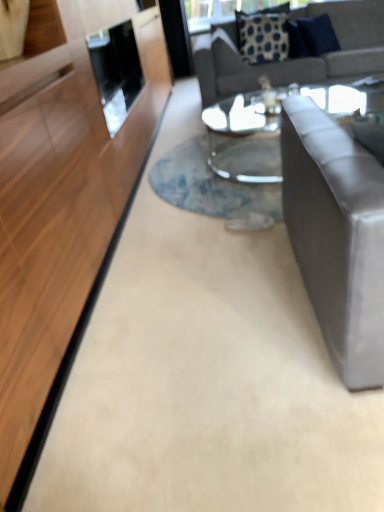
Question: Can blue dotted fabric pillow at upper center, the second pillow in the right-to-left sequence, be found inside satin gray couch at right, which ranks as the 2th studio couch in back-to-front order?

Choices:
 (A) no
 (B) yes

Answer: (A)

Question: Is satin gray couch at right, acting as the 1th studio couch starting from the front, at the right side of blue dotted fabric pillow at upper center, the second pillow in the right-to-left sequence?

Choices:
 (A) yes
 (B) no

Answer: (B)

Question: Is satin gray couch at right, acting as the 1th studio couch starting from the front, touching blue dotted fabric pillow at upper center, the second pillow in the right-to-left sequence?

Choices:
 (A) yes
 (B) no

Answer: (B)

Question: Is satin gray couch at right, placed as the second studio couch when sorted from top to bottom, not inside blue dotted fabric pillow at upper center, the 1th pillow in the left-to-right sequence?

Choices:
 (A) no
 (B) yes

Answer: (B)

Question: Is satin gray couch at right, acting as the 1th studio couch starting from the front, positioned far away from blue dotted fabric pillow at upper center, the 1th pillow in the left-to-right sequence?

Choices:
 (A) yes
 (B) no

Answer: (A)

Question: Looking at the image, does clear glass coffee table at center seem bigger or smaller compared to blue dotted fabric pillow at upper center, the second pillow in the right-to-left sequence?

Choices:
 (A) small
 (B) big

Answer: (B)

Question: Based on their positions, is clear glass coffee table at center located to the left or right of blue dotted fabric pillow at upper center, the 1th pillow in the left-to-right sequence?

Choices:
 (A) right
 (B) left

Answer: (A)

Question: Is point (236, 132) closer or farther from the camera than point (259, 27)?

Choices:
 (A) closer
 (B) farther

Answer: (A)

Question: From their relative heights in the image, would you say clear glass coffee table at center is taller or shorter than blue dotted fabric pillow at upper center, the second pillow in the right-to-left sequence?

Choices:
 (A) tall
 (B) short

Answer: (B)

Question: Relative to blue dotted fabric pillow at upper center, the second pillow in the right-to-left sequence, is blue fabric pillow at upper right, positioned as the 1th pillow in right-to-left order, in front or behind?

Choices:
 (A) front
 (B) behind

Answer: (A)

Question: Considering the relative positions of blue fabric pillow at upper right, which is the 2th pillow from left to right, and blue dotted fabric pillow at upper center, the 1th pillow in the left-to-right sequence, in the image provided, is blue fabric pillow at upper right, which is the 2th pillow from left to right, to the left or to the right of blue dotted fabric pillow at upper center, the 1th pillow in the left-to-right sequence,?

Choices:
 (A) left
 (B) right

Answer: (B)

Question: From the image's perspective, relative to blue dotted fabric pillow at upper center, the 1th pillow in the left-to-right sequence, is blue fabric pillow at upper right, positioned as the 1th pillow in right-to-left order, above or below?

Choices:
 (A) above
 (B) below

Answer: (A)

Question: Is blue fabric pillow at upper right, which is the 2th pillow from left to right, taller or shorter than blue dotted fabric pillow at upper center, the second pillow in the right-to-left sequence?

Choices:
 (A) short
 (B) tall

Answer: (A)

Question: Considering the positions of satin gray couch at right, acting as the 1th studio couch starting from the front, and blue dotted fabric pillow at upper center, the second pillow in the right-to-left sequence, in the image, is satin gray couch at right, acting as the 1th studio couch starting from the front, taller or shorter than blue dotted fabric pillow at upper center, the second pillow in the right-to-left sequence,?

Choices:
 (A) short
 (B) tall

Answer: (B)

Question: In terms of size, does satin gray couch at right, which ranks as the 2th studio couch in back-to-front order, appear bigger or smaller than blue dotted fabric pillow at upper center, the 1th pillow in the left-to-right sequence?

Choices:
 (A) big
 (B) small

Answer: (A)